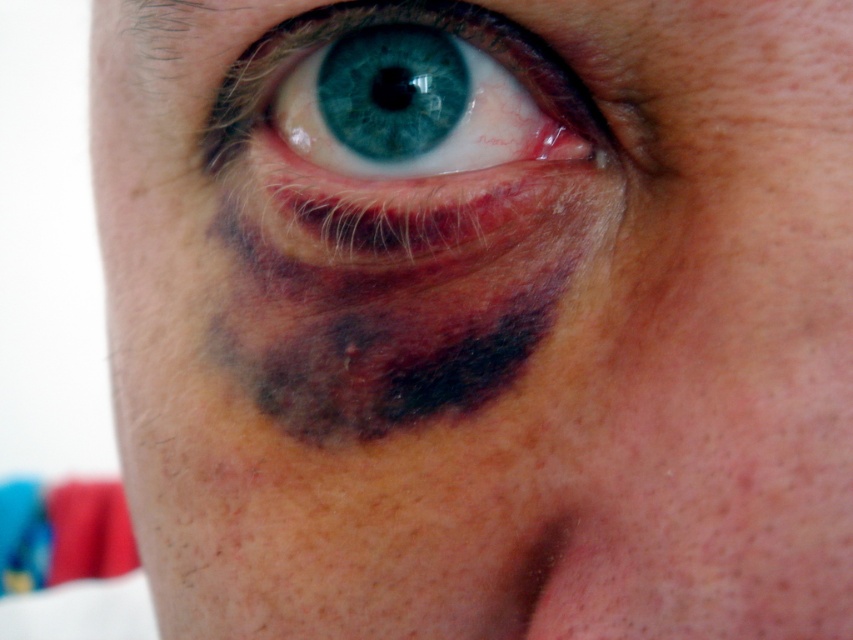
Question: Which point is closer to the camera taking this photo?

Choices:
 (A) (433, 186)
 (B) (163, 3)

Answer: (A)

Question: Is matte skin at upper center behind brown hair at upper left?

Choices:
 (A) yes
 (B) no

Answer: (B)

Question: Which object is farther from the camera taking this photo?

Choices:
 (A) blue matte eye at center
 (B) brown hair at upper left
 (C) matte skin at upper center

Answer: (B)

Question: Which of the following is the farthest from the observer?

Choices:
 (A) (367, 220)
 (B) (465, 188)

Answer: (A)

Question: Where is matte skin at upper center located in relation to brown hair at upper left in the image?

Choices:
 (A) left
 (B) right

Answer: (B)

Question: Is blue matte eye at center bigger than brown hair at upper left?

Choices:
 (A) yes
 (B) no

Answer: (A)